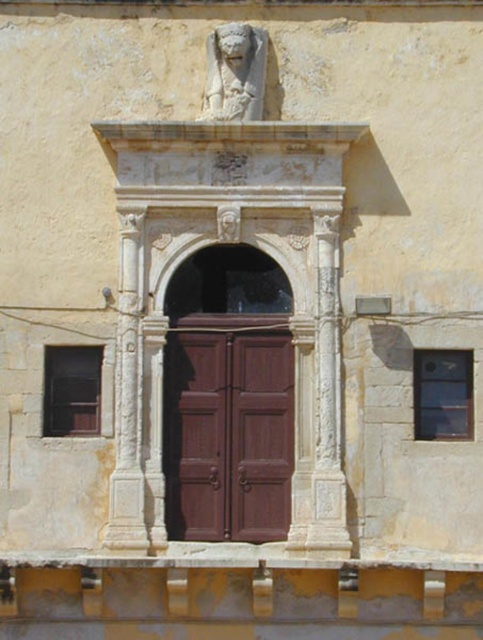
Identify the location of brown wooden door at center. The width and height of the screenshot is (483, 640). [227, 428].

Between brown wooden door at center and clear glass window at upper right, which one appears on the left side from the viewer's perspective?

Positioned to the left is brown wooden door at center.

This screenshot has height=640, width=483. I want to click on brown wooden door at center, so click(x=227, y=428).

This screenshot has width=483, height=640. I want to click on brown wooden door at center, so click(227, 428).

Between white stone lion at upper center and dark glass window at left, which one has less height?

dark glass window at left

Measure the distance between white stone lion at upper center and dark glass window at left.

A distance of 4.64 meters exists between white stone lion at upper center and dark glass window at left.

Is point (235, 24) farther from camera compared to point (73, 381)?

No, it is not.

Find the location of a particular element. The width and height of the screenshot is (483, 640). white stone lion at upper center is located at coordinates (235, 72).

Between clear glass window at upper right and dark glass window at left, which one appears on the right side from the viewer's perspective?

From the viewer's perspective, clear glass window at upper right appears more on the right side.

Is point (445, 353) farther from viewer compared to point (89, 380)?

No, (445, 353) is in front of (89, 380).

Find the location of a particular element. Image resolution: width=483 pixels, height=640 pixels. clear glass window at upper right is located at coordinates 442,394.